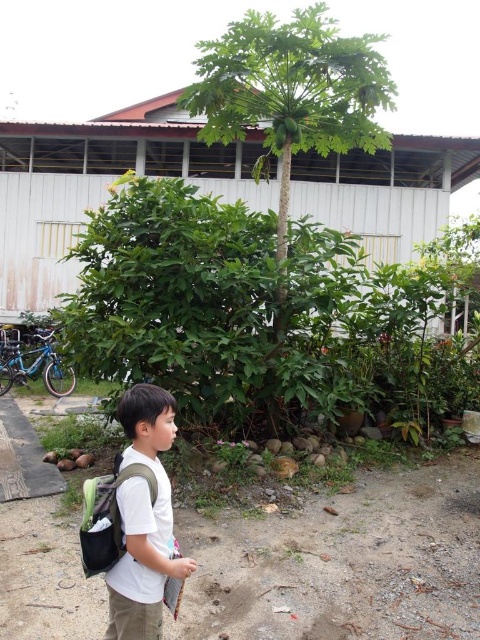
You are a photographer trying to capture the boy in the image. You want to ensure the white matte shirt at lower left and the matte black backpack at lower left are both visible in the frame. Based on their positions, which object is closer to the camera?

The white matte shirt at lower left is in front of the matte black backpack at lower left, so the white matte shirt at lower left is closer to the camera.

You are the boy in the image and you want to put your matte black backpack at lower left on the ground. Which direction should you move it to so that it is directly next to your white matte shirt at lower left?

You should move the matte black backpack at lower left to the right so that it is directly next to the white matte shirt at lower left, since the white matte shirt at lower left is already positioned to the right of the backpack.

You are a fashion designer observing the image. You need to decide whether the white matte shirt at lower left and the matte black backpack at lower left can be displayed side by side in a narrow showcase. Can you determine if the combined width of both items would exceed the showcase space?

The white matte shirt at lower left might be wider than matte black backpack at lower left, so the combined width could potentially exceed the showcase space depending on their individual widths.